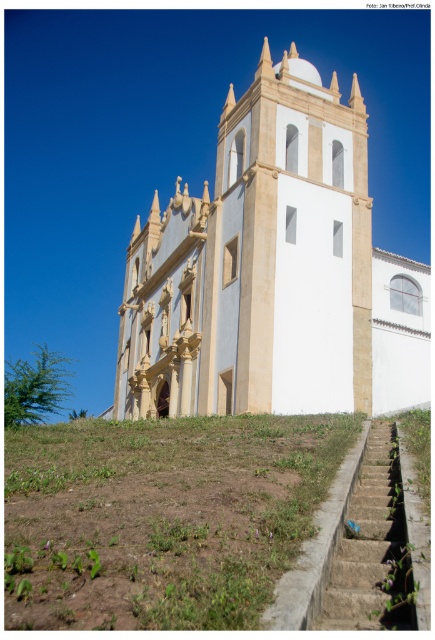
You are standing at point (x=257, y=568) and want to walk to the church entrance. The path is 64.62 feet long. If your average walking speed is 3 feet per second, how many seconds will it take you to reach the entrance?

The path between point (x=257, y=568) and the church entrance is 64.62 feet long. At a walking speed of 3 feet per second, it will take 64.62 divided by 3 equals approximately 21.54 seconds to reach the entrance.

You are standing at the bottom of the concrete stairs at lower right and want to reach the white smooth church at center. In which direction should you walk to get there?

You should walk to the left because the white smooth church at center is located to the left of the concrete stairs at lower right.